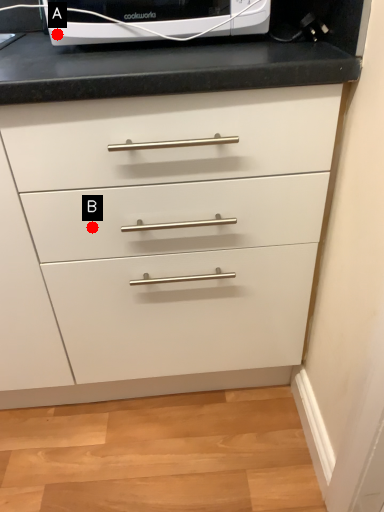
Question: Two points are circled on the image, labeled by A and B beside each circle. Which point appears farthest from the camera in this image?

Choices:
 (A) A is further
 (B) B is further

Answer: (B)